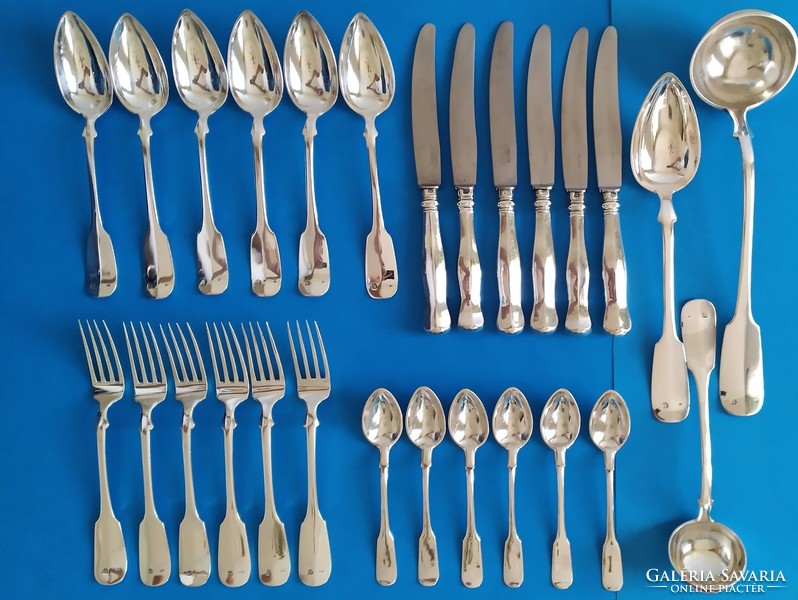
Find the location of `fork`. fork is located at coordinates (101, 360), (145, 379), (188, 394), (243, 387), (259, 393), (314, 396).